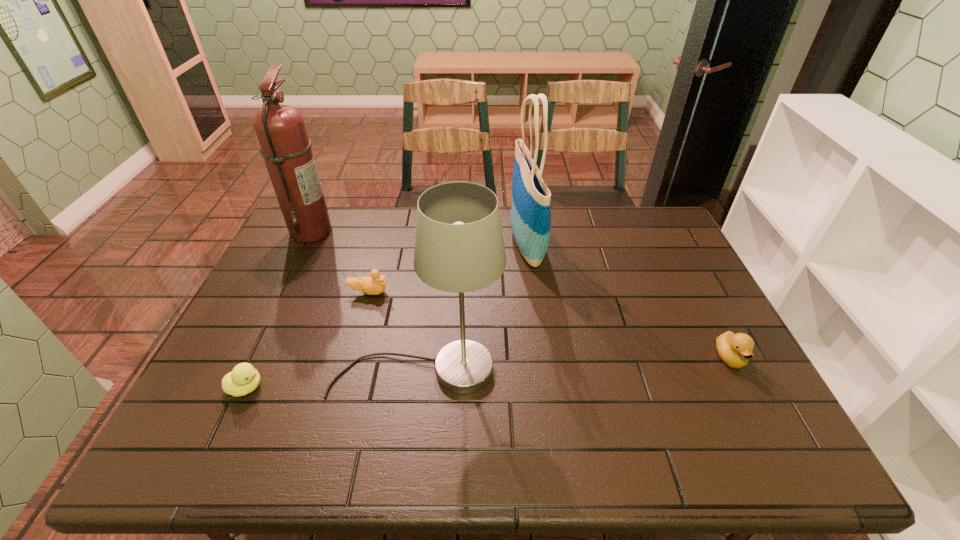
Where is `free point located facing forward on the rightmost duckling`? free point located facing forward on the rightmost duckling is located at coordinates (766, 428).

Find the location of a particular element. The height and width of the screenshot is (540, 960). free space located on the face of the fourth nearest object is located at coordinates (515, 293).

You are a GUI agent. You are given a task and a screenshot of the screen. Output one action in this format:
    pyautogui.click(x=<x>, y=<y>)
    Task: Click on the vacant area situated 0.270m at the beak of the leftmost duckling
    This screenshot has width=960, height=540.
    Given the screenshot: What is the action you would take?
    pyautogui.click(x=377, y=387)

Identify the location of fire extinguisher situated at the far edge. The width and height of the screenshot is (960, 540). (280, 130).

Where is `tote bag that is at the far edge`? This screenshot has width=960, height=540. tote bag that is at the far edge is located at coordinates (530, 218).

Identify the location of fire extinguisher at the left edge. The image size is (960, 540). (280, 130).

The image size is (960, 540). I want to click on duckling that is at the left edge, so click(x=244, y=378).

Image resolution: width=960 pixels, height=540 pixels. In order to click on object present at the right edge in this screenshot , I will do `click(735, 350)`.

Identify the location of object at the far left corner. (280, 130).

Where is `free location at the far edge of the desktop`? free location at the far edge of the desktop is located at coordinates (506, 232).